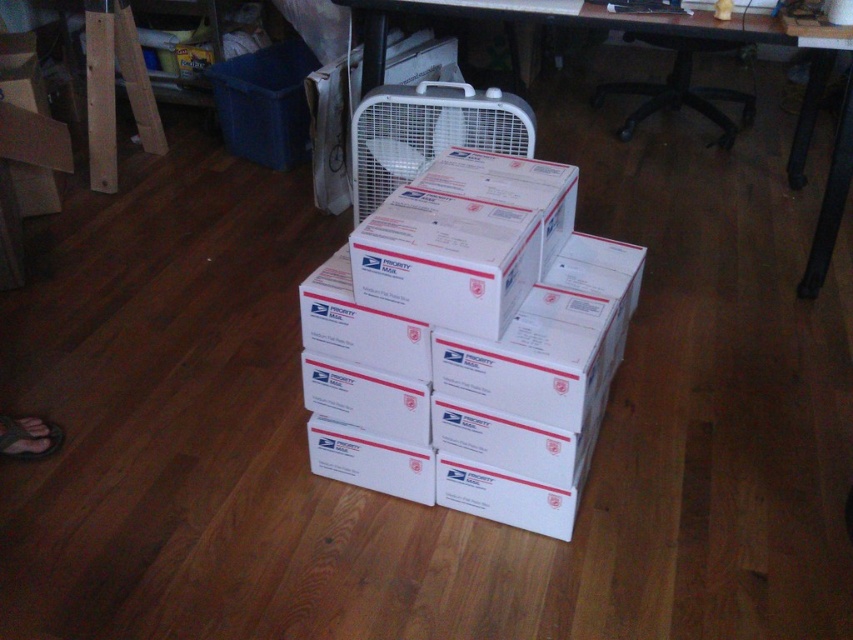
Can you confirm if white cardboard boxes at center is wider than white plastic computer desk at upper center?

Incorrect, white cardboard boxes at center's width does not surpass white plastic computer desk at upper center's.

Does point (302, 291) come farther from viewer compared to point (769, 40)?

No, it is not.

The width and height of the screenshot is (853, 640). I want to click on white cardboard boxes at center, so click(x=473, y=349).

Locate an element on the screen. The image size is (853, 640). white cardboard boxes at center is located at coordinates (473, 349).